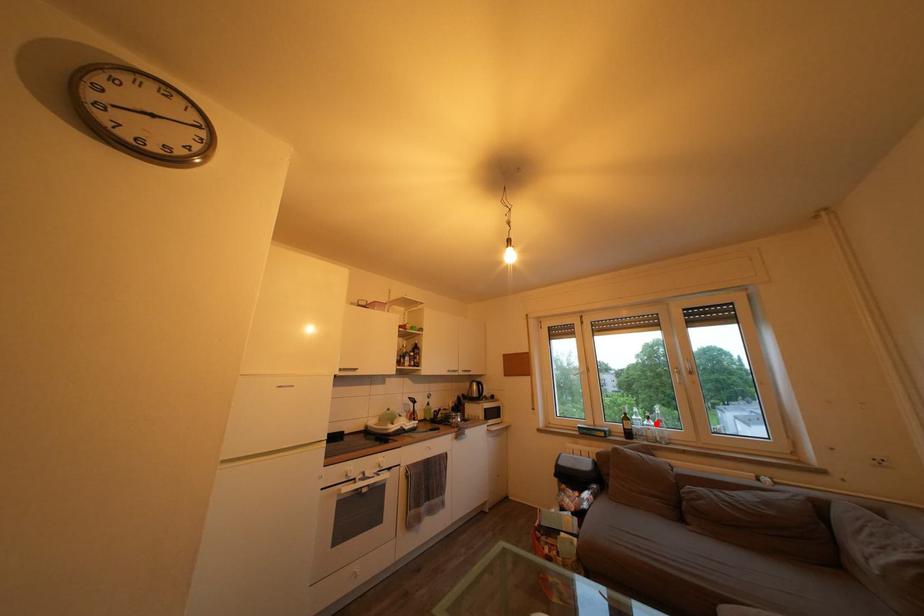
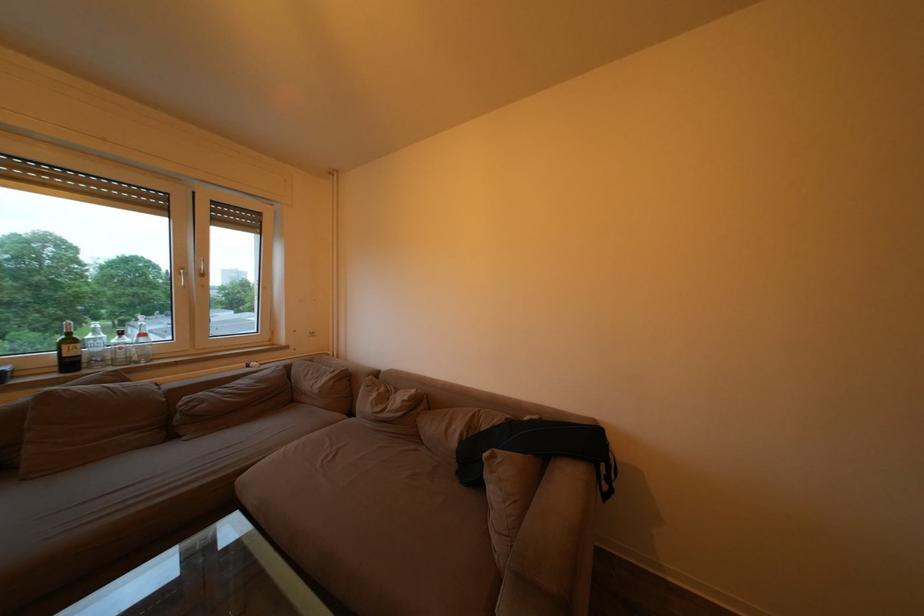
Question: I am providing you with two images of the same scene from different viewpoints. A red point is marked on the first image. Is the red point's position out of view in image 2?

Choices:
 (A) Yes
 (B) No

Answer: (B)